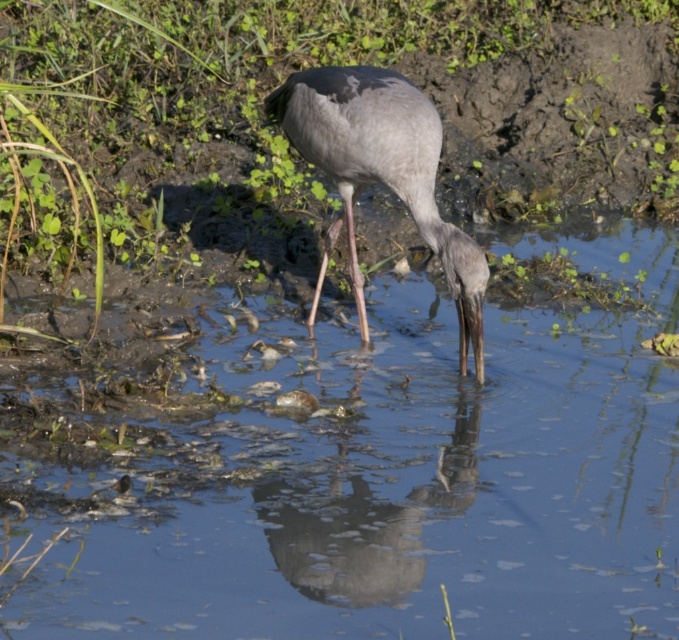
Question: Which point is closer to the camera?

Choices:
 (A) (401, 108)
 (B) (287, 419)

Answer: (A)

Question: Can you confirm if clear water at center is positioned to the right of gray matte bird at center?

Choices:
 (A) no
 (B) yes

Answer: (B)

Question: From the image, what is the correct spatial relationship of clear water at center in relation to gray matte bird at center?

Choices:
 (A) above
 (B) below

Answer: (B)

Question: Which of the following is the farthest from the observer?

Choices:
 (A) clear water at center
 (B) gray matte bird at center

Answer: (B)

Question: Does clear water at center have a larger size compared to gray matte bird at center?

Choices:
 (A) no
 (B) yes

Answer: (B)